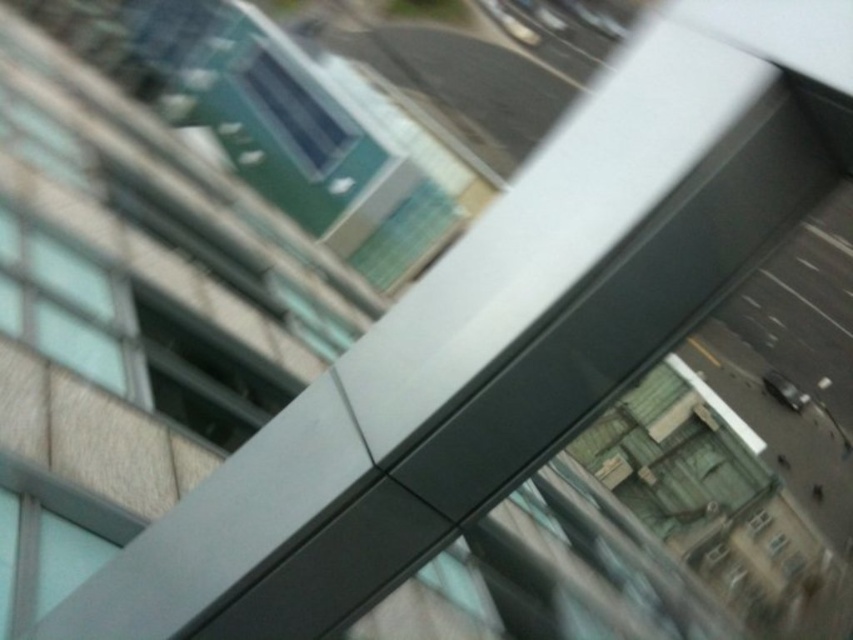
Question: Which point appears farthest from the camera in this image?

Choices:
 (A) (757, 522)
 (B) (772, 554)
 (C) (317, 148)

Answer: (B)

Question: Does matte glass window at center appear over transparent glass window at center?

Choices:
 (A) no
 (B) yes

Answer: (B)

Question: In this image, where is matte glass window at upper center located relative to transparent glass window at center?

Choices:
 (A) above
 (B) below

Answer: (A)

Question: Which of the following is the farthest from the observer?

Choices:
 (A) clear glass window at center
 (B) matte glass window at upper center
 (C) matte glass window at center

Answer: (A)

Question: Which point is closer to the camera?

Choices:
 (A) matte glass window at center
 (B) clear glass window at center
 (C) matte glass window at upper center
 (D) transparent glass window at center

Answer: (A)

Question: Can you confirm if matte glass window at center is bigger than clear glass window at center?

Choices:
 (A) yes
 (B) no

Answer: (A)